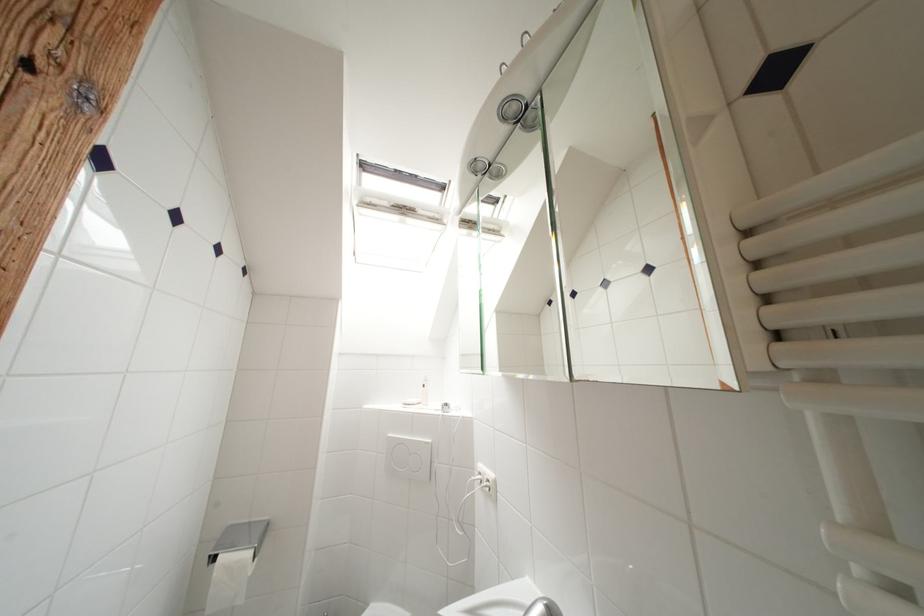
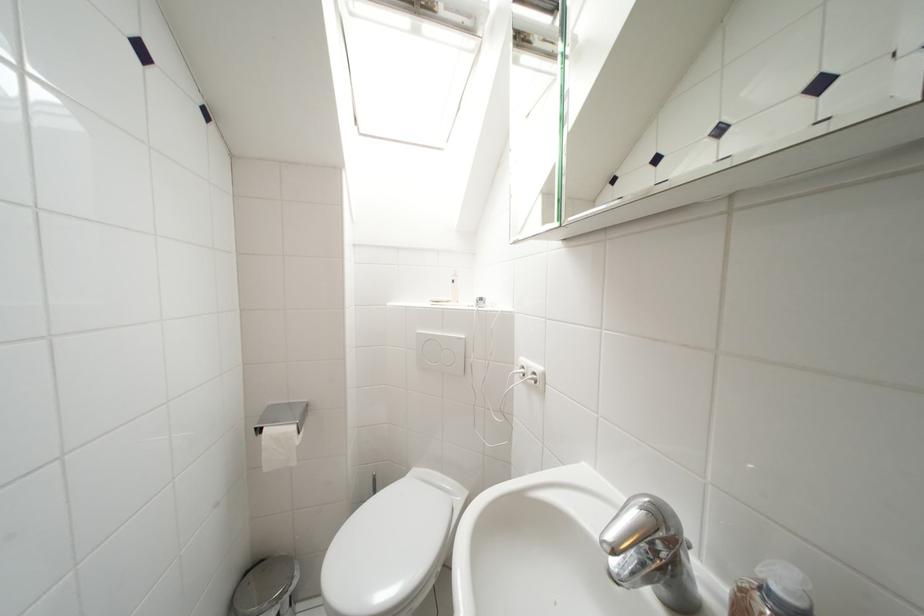
In a continuous first-person perspective shot, in which direction is the camera moving?

The movement direction of the cameraman is left, forward.